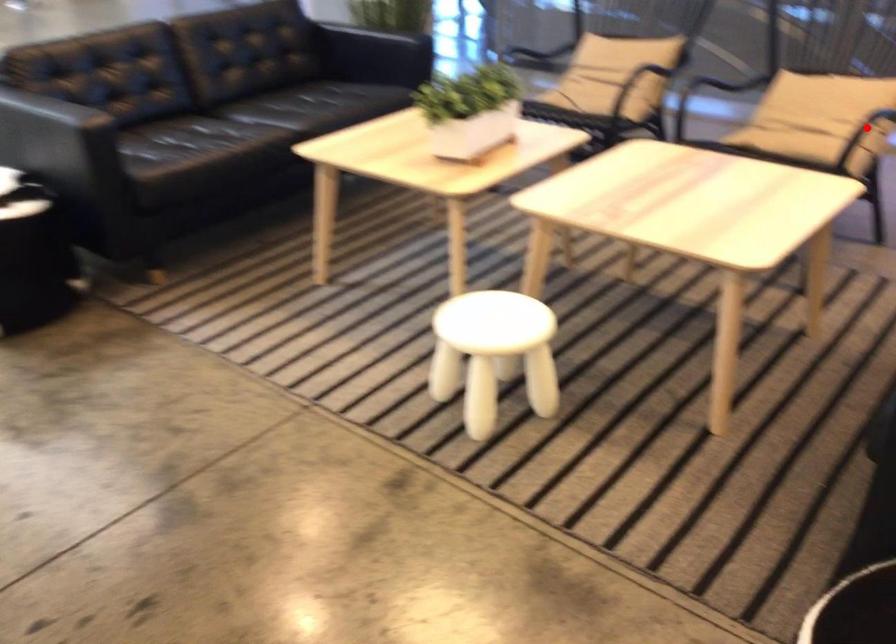
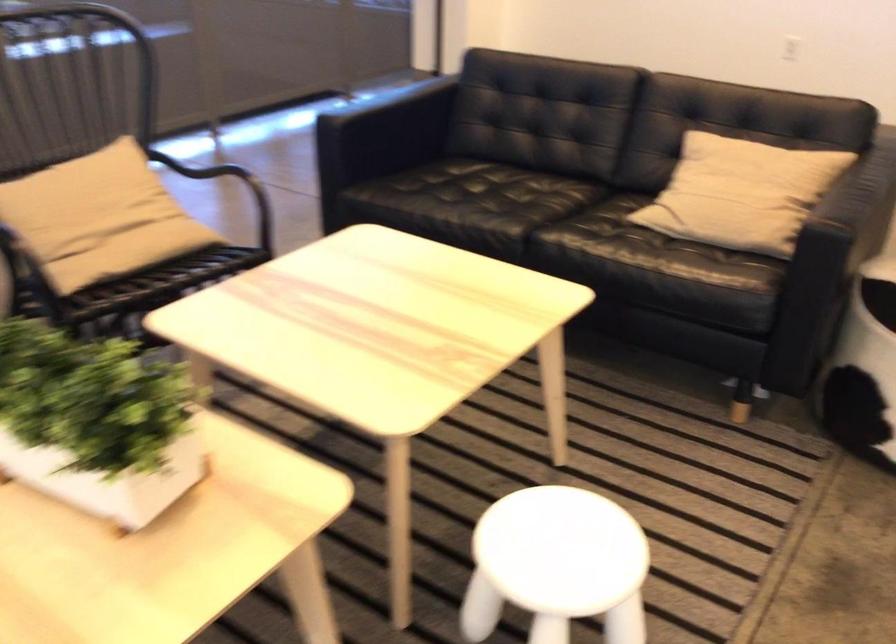
Question: I am providing you with two images of the same scene from different viewpoints. A red point is marked on the first image. Can you still see the location of the red point in image 2?

Choices:
 (A) Yes
 (B) No

Answer: (B)